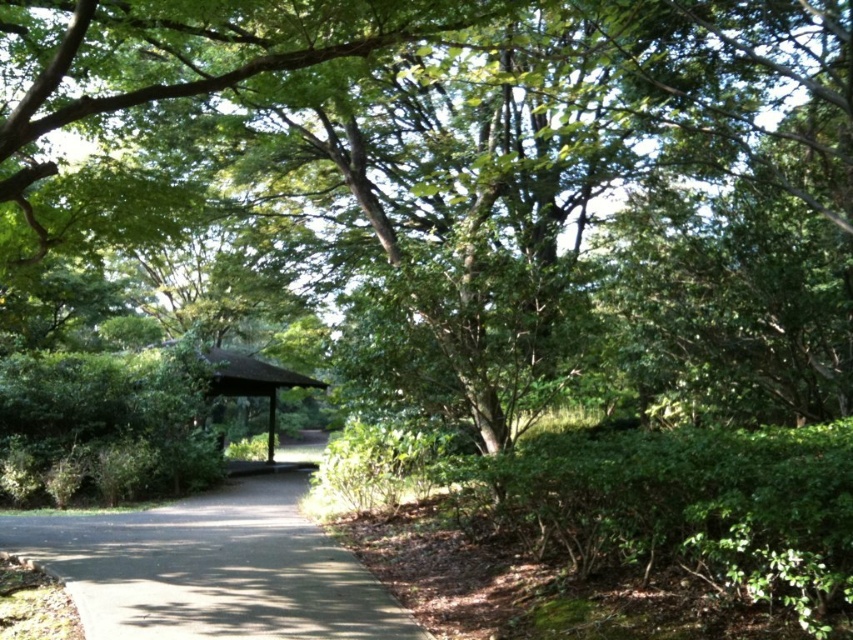
You are planning to place a picnic blanket on the ground in the scene. The picnic blanket is 2 meters wide. You have two options for placement areas from the image description. The first option is the dark gray asphalt at center, and the second option is the brown wooden gazebo at center. Which area can accommodate the picnic blanket without overlapping its edges?

The brown wooden gazebo at center has a larger size than the dark gray asphalt at center, so the picnic blanket can fit on the brown wooden gazebo at center.

You are a landscape architect designing a new path for the park. You need to ensure that the dark gray asphalt at center is level with the brown wooden gazebo at center. Currently, which one is lower?

The dark gray asphalt at center has a lesser height compared to the brown wooden gazebo at center, so the asphalt is lower and needs to be raised to match the gazebo.